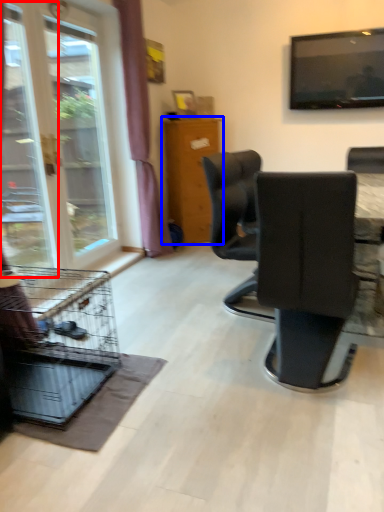
Question: Among these objects, which one is nearest to the camera, screen door (highlighted by a red box) or furniture (highlighted by a blue box)?

Choices:
 (A) screen door
 (B) furniture

Answer: (A)